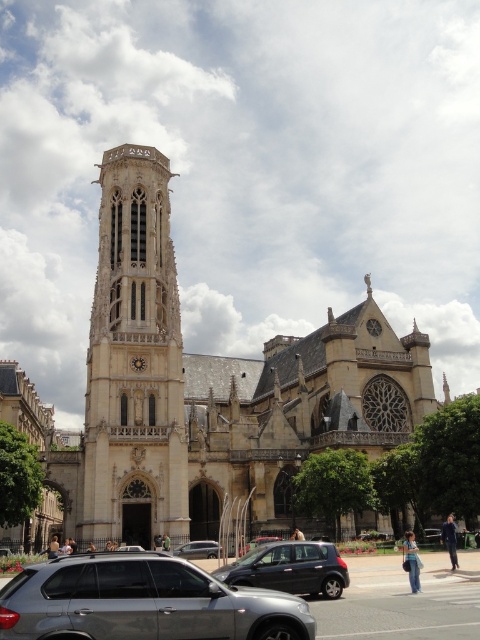
Question: Based on their relative distances, which object is nearer to the silver metallic suv at lower center?

Choices:
 (A) satin silver sedan at center
 (B) golden stone church at center
 (C) gold metallic clock at center
 (D) stone tower at center

Answer: (A)

Question: Which is farther from the matte black car at center?

Choices:
 (A) metallic silver car at center
 (B) gold metallic clock at center
 (C) stone tower at center

Answer: (B)

Question: Does golden stone church at center appear over metallic silver car at center?

Choices:
 (A) yes
 (B) no

Answer: (A)

Question: Does golden stone church at center appear on the right side of metallic silver car at center?

Choices:
 (A) no
 (B) yes

Answer: (A)

Question: Which of these objects is positioned closest to the stone tower at center?

Choices:
 (A) matte black car at center
 (B) metallic silver car at center
 (C) gold metallic clock at center
 (D) satin silver sedan at center

Answer: (C)

Question: Can you confirm if stone tower at center is positioned to the right of gold metallic clock at center?

Choices:
 (A) yes
 (B) no

Answer: (B)